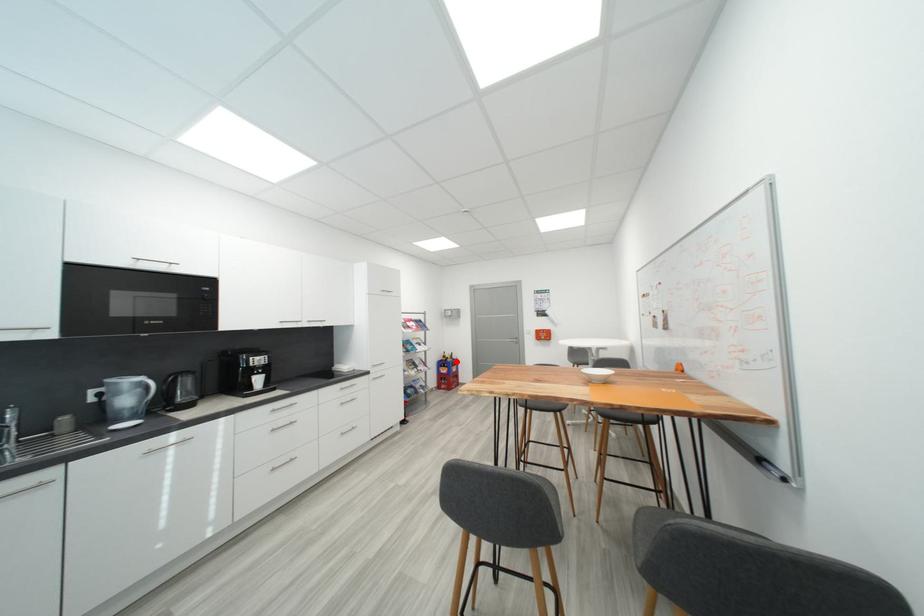
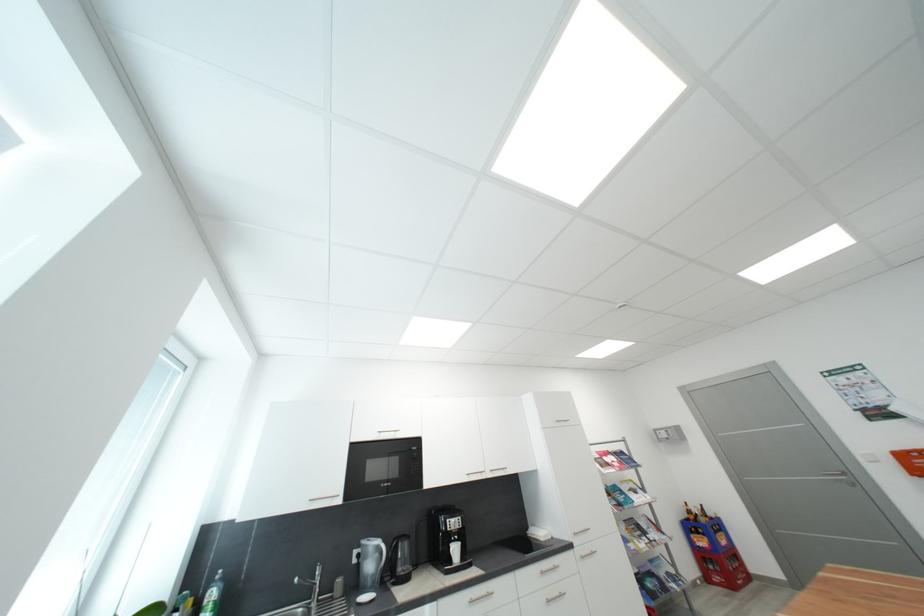
Question: I am providing you with two images of the same scene from different viewpoints. In image1, a red point is highlighted. Considering the same 3D point in image2, which of the following is correct?

Choices:
 (A) It is closer
 (B) It is farther

Answer: (A)